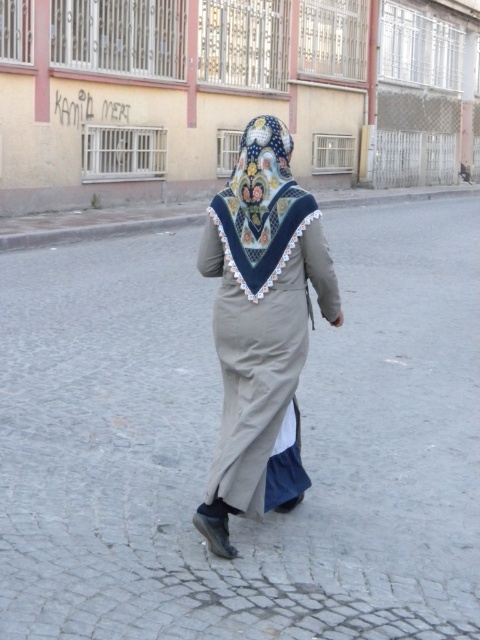
You are standing at the camera position looking at the scene. There is a point marked at coordinates [264,369]. What object is located at that point?

The point at coordinates [264,369] indicates the beige cotton robe at center.

You are a fashion designer observing the person in the image. You need to determine if the beige cotton robe at center can be paired with the embroidered silk headscarf at center for a runway show. Considering their sizes, will the robe adequately cover the headscarf when worn together?

The beige cotton robe at center is wider than the embroidered silk headscarf at center, so it should adequately cover the headscarf when worn together.

You are a tailor measuring the distance between the beige cotton robe at center and the embroidered silk headscarf at center for a custom fit. The minimum required space for proper tailoring is 24 inches. Can you proceed with the current spacing?

The distance between the beige cotton robe at center and the embroidered silk headscarf at center is 23.24 inches, which is less than the required 24 inches. Therefore, you cannot proceed with the current spacing and need to adjust the positioning to meet the minimum requirement.